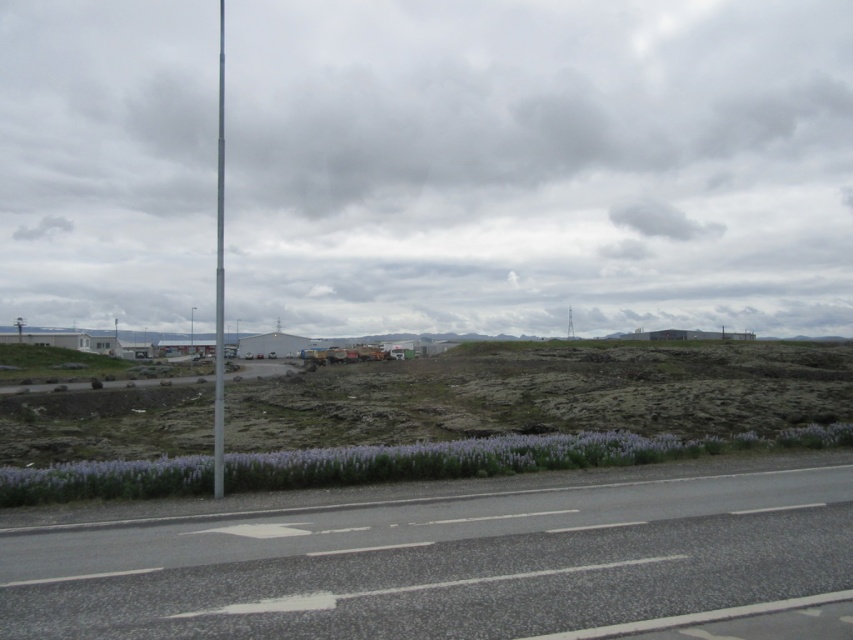
Question: Considering the relative positions of gray asphalt highway at lower center and metallic pole at left in the image provided, where is gray asphalt highway at lower center located with respect to metallic pole at left?

Choices:
 (A) below
 (B) above

Answer: (A)

Question: Among these points, which one is farthest from the camera?

Choices:
 (A) (219, 493)
 (B) (828, 476)

Answer: (B)

Question: Can you confirm if gray asphalt highway at lower center is smaller than metallic pole at left?

Choices:
 (A) no
 (B) yes

Answer: (B)

Question: Which object appears farthest from the camera in this image?

Choices:
 (A) gray asphalt highway at lower center
 (B) metallic pole at left

Answer: (B)

Question: Observing the image, what is the correct spatial positioning of gray asphalt highway at lower center in reference to metallic pole at left?

Choices:
 (A) above
 (B) below

Answer: (B)

Question: Among these objects, which one is nearest to the camera?

Choices:
 (A) gray asphalt highway at lower center
 (B) metallic pole at left

Answer: (A)